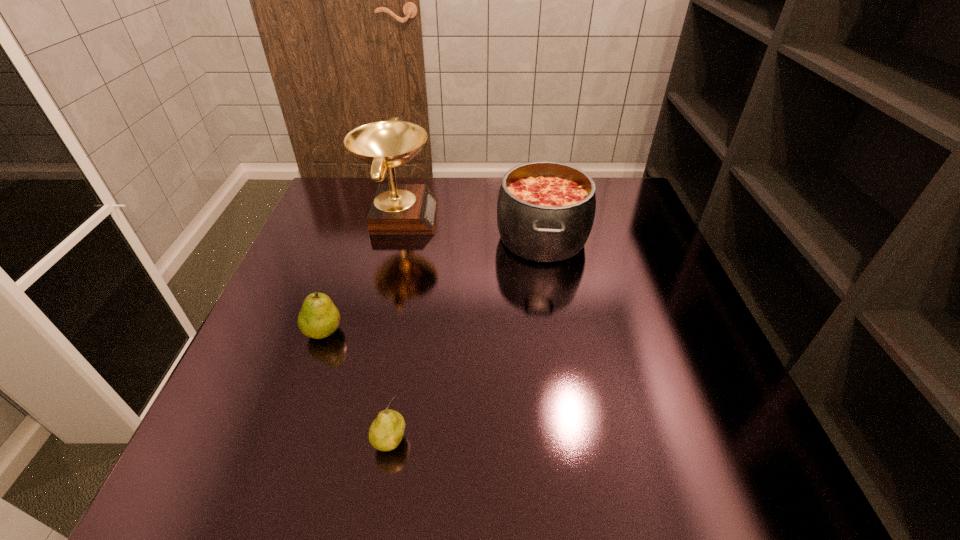
At what (x,y) coordinates should I click in order to perform the action: click on free spot located on the right of the shorter pear. Please return your answer as a coordinate pair (x, y). Looking at the image, I should click on (504, 441).

Locate an element on the screen. award that is at the far edge is located at coordinates (397, 209).

In order to click on casserole positioned at the far edge in this screenshot , I will do (x=545, y=211).

You are a GUI agent. You are given a task and a screenshot of the screen. Output one action in this format:
    pyautogui.click(x=<x>, y=<y>)
    Task: Click on the object at the near edge
    The height and width of the screenshot is (540, 960).
    Given the screenshot: What is the action you would take?
    pyautogui.click(x=386, y=432)

At what (x,y) coordinates should I click in order to perform the action: click on award present at the left edge. Please return your answer as a coordinate pair (x, y). Looking at the image, I should click on (397, 209).

This screenshot has height=540, width=960. In order to click on pear situated at the left edge in this screenshot , I will do `click(318, 318)`.

You are a GUI agent. You are given a task and a screenshot of the screen. Output one action in this format:
    pyautogui.click(x=<x>, y=<y>)
    Task: Click on the object present at the far left corner
    
    Given the screenshot: What is the action you would take?
    pyautogui.click(x=397, y=209)

Where is `vacant area at the far edge`? The image size is (960, 540). vacant area at the far edge is located at coordinates (440, 217).

In the image, there is a desktop. Find the location of `blank space at the near edge`. blank space at the near edge is located at coordinates (605, 442).

In the image, there is a desktop. Find the location of `free region at the left edge`. free region at the left edge is located at coordinates (348, 272).